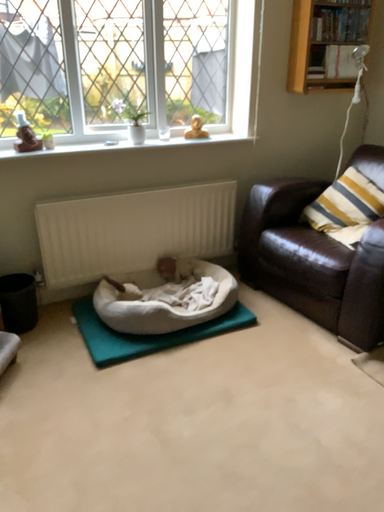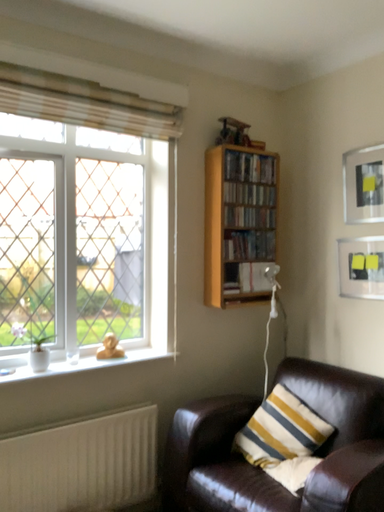
Question: How did the camera likely rotate when shooting the video?

Choices:
 (A) rotated downward
 (B) rotated upward

Answer: (B)